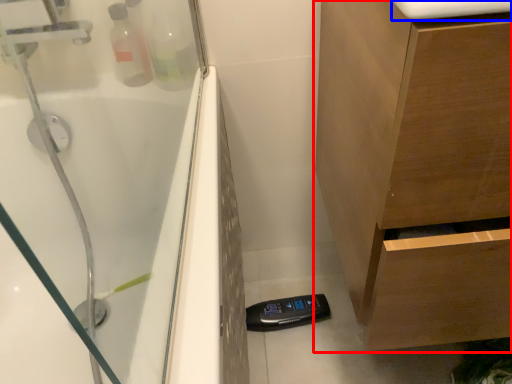
Question: Among these objects, which one is farthest to the camera, bathroom cabinet (highlighted by a red box) or counter top (highlighted by a blue box)?

Choices:
 (A) bathroom cabinet
 (B) counter top

Answer: (B)